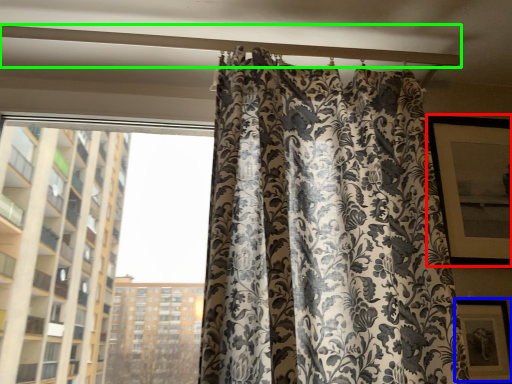
Question: Which is nearer to the window screen (highlighted by a red box)? picture frame (highlighted by a blue box) or beam (highlighted by a green box).

Choices:
 (A) picture frame
 (B) beam

Answer: (A)